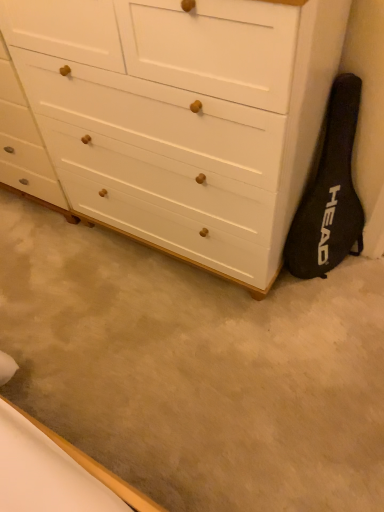
Describe the element at coordinates (196, 369) in the screenshot. I see `beige carpet at lower center` at that location.

The width and height of the screenshot is (384, 512). Find the location of `beige carpet at lower center`. beige carpet at lower center is located at coordinates (196, 369).

Where is `beige carpet at lower center`? beige carpet at lower center is located at coordinates (196, 369).